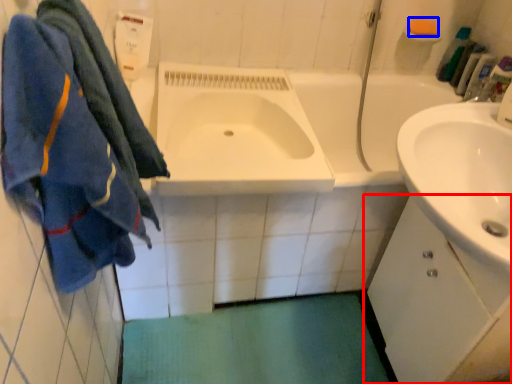
Question: Which object is further to the camera taking this photo, bathroom cabinet (highlighted by a red box) or soap (highlighted by a blue box)?

Choices:
 (A) bathroom cabinet
 (B) soap

Answer: (B)